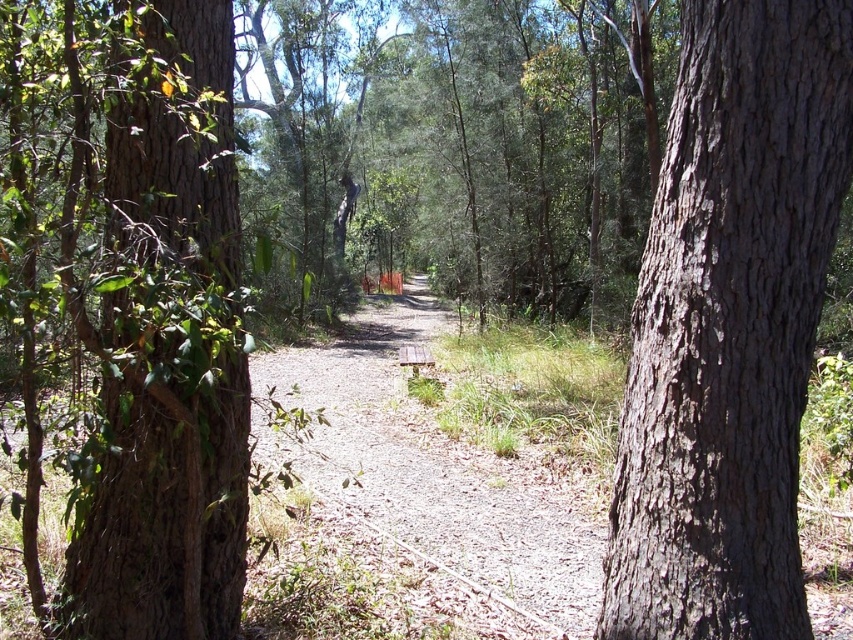
Consider the image. Does brown rough bark tree at right appear over brown gravel path at center?

Yes.

Which of these two, brown rough bark tree at right or brown gravel path at center, stands taller?

With more height is brown rough bark tree at right.

What do you see at coordinates (729, 324) in the screenshot?
I see `brown rough bark tree at right` at bounding box center [729, 324].

The image size is (853, 640). I want to click on brown rough bark tree at right, so click(729, 324).

Based on the photo, does brown rough bark tree at right have a smaller size compared to brown rough bark tree at left?

Correct, brown rough bark tree at right occupies less space than brown rough bark tree at left.

Find the location of a particular element. brown rough bark tree at right is located at coordinates (729, 324).

Between point (780, 218) and point (209, 385), which one is positioned behind?

The point (780, 218) is behind.

Locate an element on the screen. The image size is (853, 640). brown rough bark tree at right is located at coordinates (729, 324).

Based on the photo, is brown rough bark tree at left closer to the viewer compared to brown gravel path at center?

That is True.

Is brown rough bark tree at left behind brown gravel path at center?

No.

Find the location of a particular element. The width and height of the screenshot is (853, 640). brown rough bark tree at left is located at coordinates (166, 342).